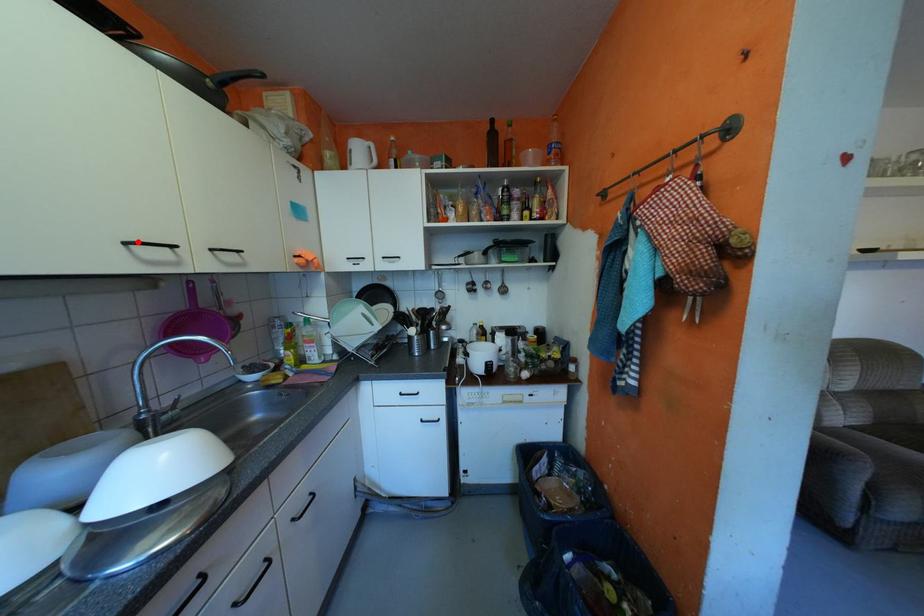
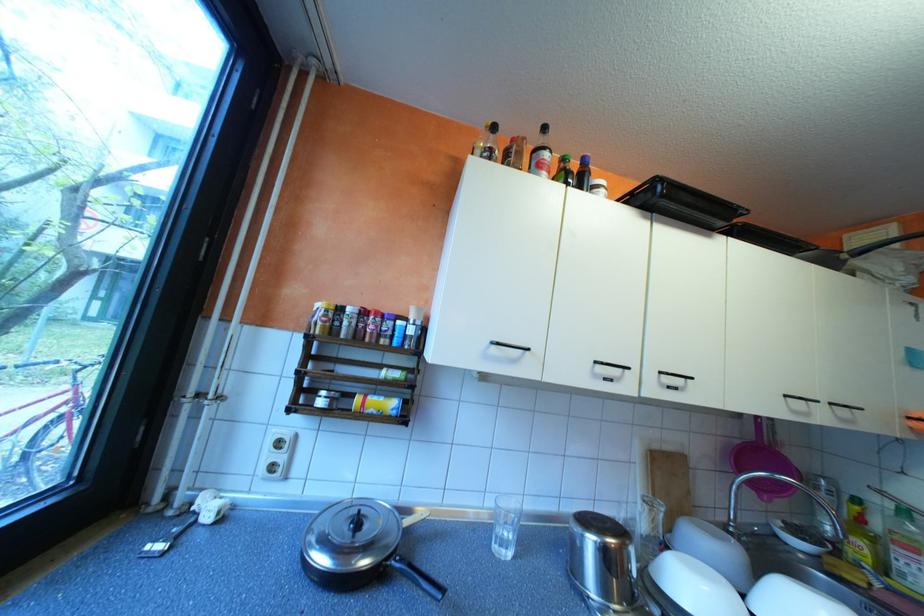
Find the pixel in the second image that matches the highlighted location in the first image.

(797, 395)